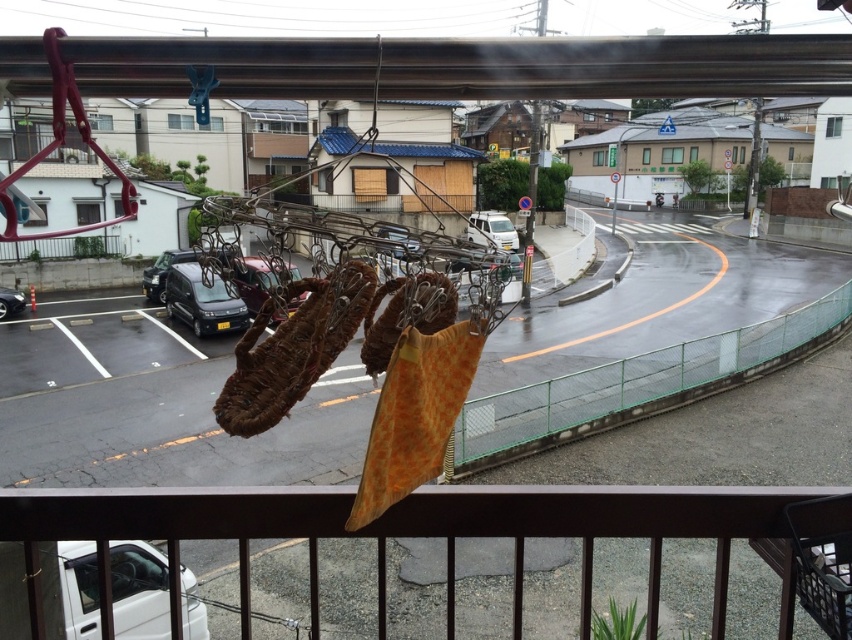
Question: Which point is farther from the camera taking this photo?

Choices:
 (A) (273, 323)
 (B) (396, 241)
 (C) (666, 529)

Answer: (A)

Question: Does brown wooden rail at lower center appear under white matte van at center?

Choices:
 (A) no
 (B) yes

Answer: (B)

Question: Where is shiny black car at center located in relation to shiny black sedan at left in the image?

Choices:
 (A) right
 (B) left

Answer: (A)

Question: Which of the following is the farthest from the observer?

Choices:
 (A) (642, 496)
 (B) (273, 273)

Answer: (A)

Question: Is shiny black car at center wider than white matte van at center?

Choices:
 (A) no
 (B) yes

Answer: (B)

Question: Which of the following is the closest to the observer?

Choices:
 (A) brown wooden rail at lower center
 (B) shiny black car at center
 (C) white matte van at center

Answer: (A)